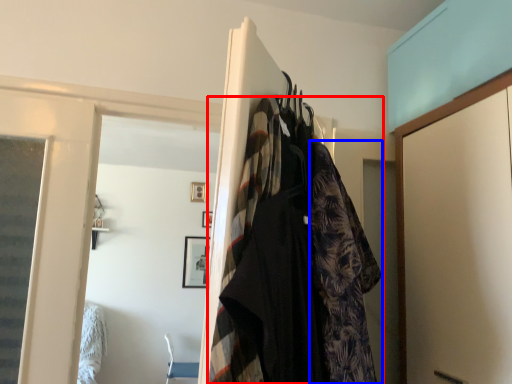
Question: Which point is closer to the camera, fancy dress (highlighted by a red box) or clothing (highlighted by a blue box)?

Choices:
 (A) fancy dress
 (B) clothing

Answer: (A)